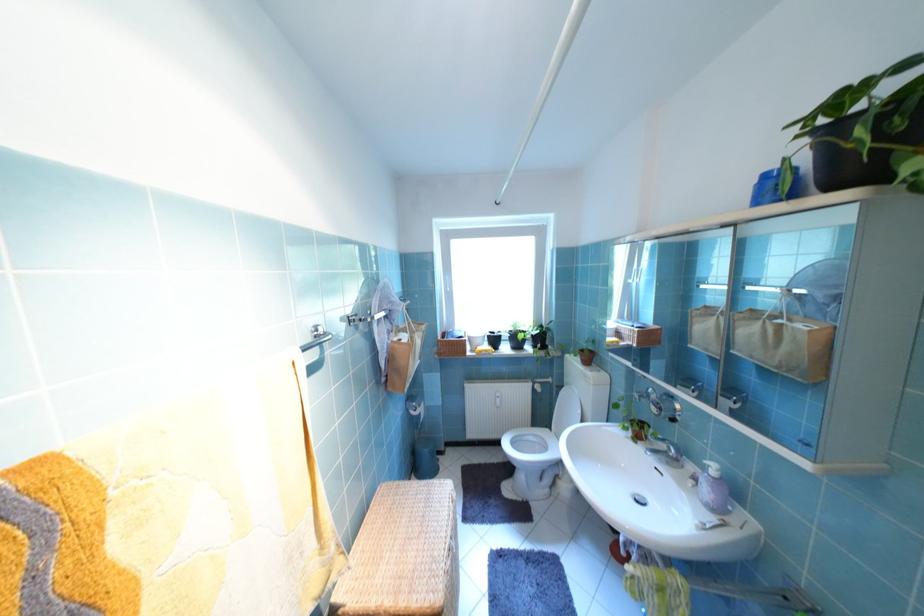
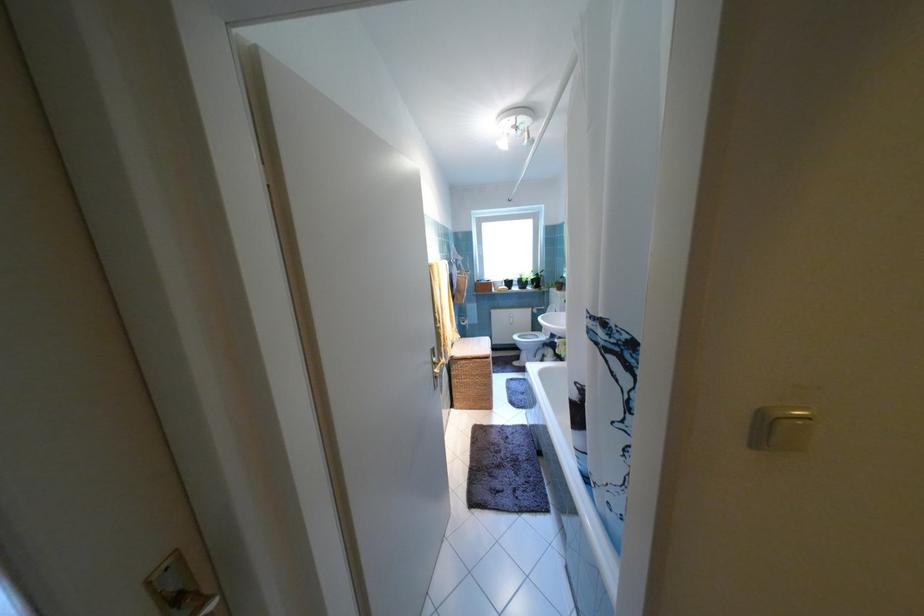
Find the pixel in the second image that matches the point at 504,341 in the first image.

(517, 284)